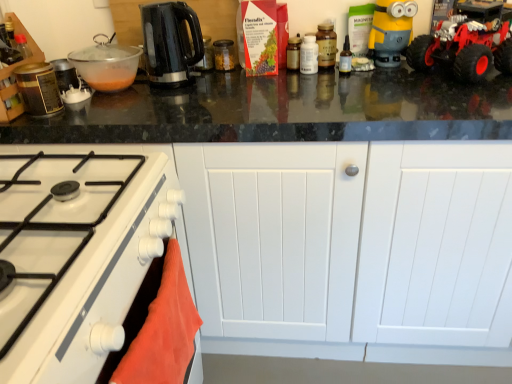
Question: Is black glossy electric kettle at upper center, arranged as the third kitchen appliance when viewed from the left, not within transparent plastic bowl at upper left, the second kitchen appliance when ordered from left to right?

Choices:
 (A) no
 (B) yes

Answer: (B)

Question: From a real-world perspective, is black glossy electric kettle at upper center, which is the fifth kitchen appliance in right-to-left order, over transparent plastic bowl at upper left, which ranks as the sixth kitchen appliance in right-to-left order?

Choices:
 (A) no
 (B) yes

Answer: (B)

Question: Could you tell me if black glossy electric kettle at upper center, which is the fifth kitchen appliance in right-to-left order, is facing transparent plastic bowl at upper left, which ranks as the sixth kitchen appliance in right-to-left order?

Choices:
 (A) no
 (B) yes

Answer: (A)

Question: Are black glossy electric kettle at upper center, arranged as the third kitchen appliance when viewed from the left, and transparent plastic bowl at upper left, the second kitchen appliance when ordered from left to right, located far from each other?

Choices:
 (A) yes
 (B) no

Answer: (B)

Question: Considering the relative sizes of black glossy electric kettle at upper center, which is the fifth kitchen appliance in right-to-left order, and transparent plastic bowl at upper left, the second kitchen appliance when ordered from left to right, in the image provided, is black glossy electric kettle at upper center, which is the fifth kitchen appliance in right-to-left order, shorter than transparent plastic bowl at upper left, the second kitchen appliance when ordered from left to right,?

Choices:
 (A) no
 (B) yes

Answer: (A)

Question: Is black glossy electric kettle at upper center, arranged as the third kitchen appliance when viewed from the left, in contact with transparent plastic bowl at upper left, the second kitchen appliance when ordered from left to right?

Choices:
 (A) no
 (B) yes

Answer: (A)

Question: Is white glossy gas stove at lower left looking in the opposite direction of matte brown jar at upper right, the 1th kitchen appliance when ordered from right to left?

Choices:
 (A) no
 (B) yes

Answer: (A)

Question: Is white glossy gas stove at lower left positioned behind matte brown jar at upper right, the 7th kitchen appliance when ordered from left to right?

Choices:
 (A) no
 (B) yes

Answer: (A)

Question: From the image's perspective, is white glossy gas stove at lower left under matte brown jar at upper right, the 1th kitchen appliance when ordered from right to left?

Choices:
 (A) yes
 (B) no

Answer: (A)

Question: Is white glossy gas stove at lower left outside of matte brown jar at upper right, the 1th kitchen appliance when ordered from right to left?

Choices:
 (A) no
 (B) yes

Answer: (B)

Question: Does white glossy gas stove at lower left have a smaller size compared to matte brown jar at upper right, the 7th kitchen appliance when ordered from left to right?

Choices:
 (A) no
 (B) yes

Answer: (A)

Question: Is white glossy gas stove at lower left to the left of matte brown jar at upper right, the 1th kitchen appliance when ordered from right to left, from the viewer's perspective?

Choices:
 (A) yes
 (B) no

Answer: (A)

Question: Is yellow matte minion toy at upper right oriented towards metallic canister at left, which is the first kitchen appliance in left-to-right order?

Choices:
 (A) no
 (B) yes

Answer: (A)